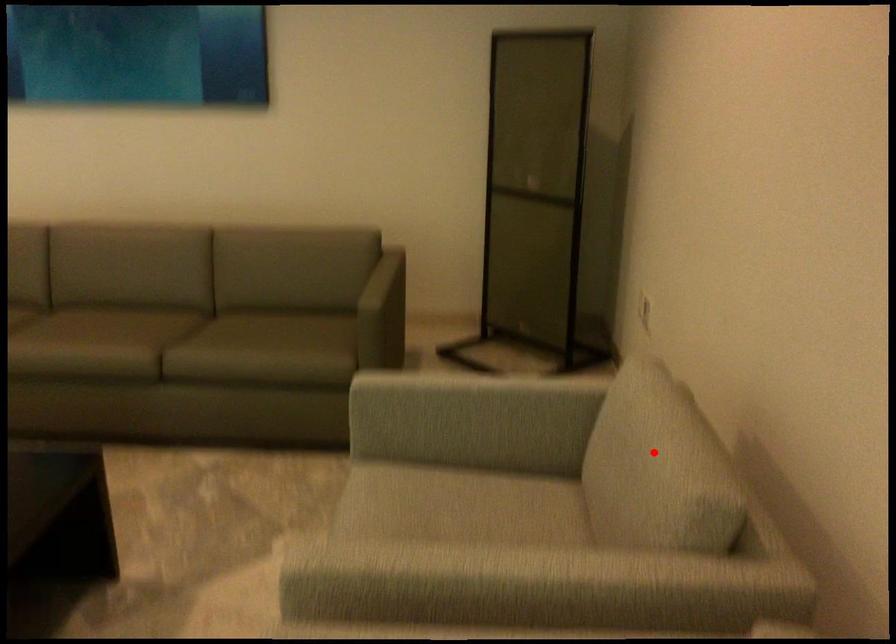
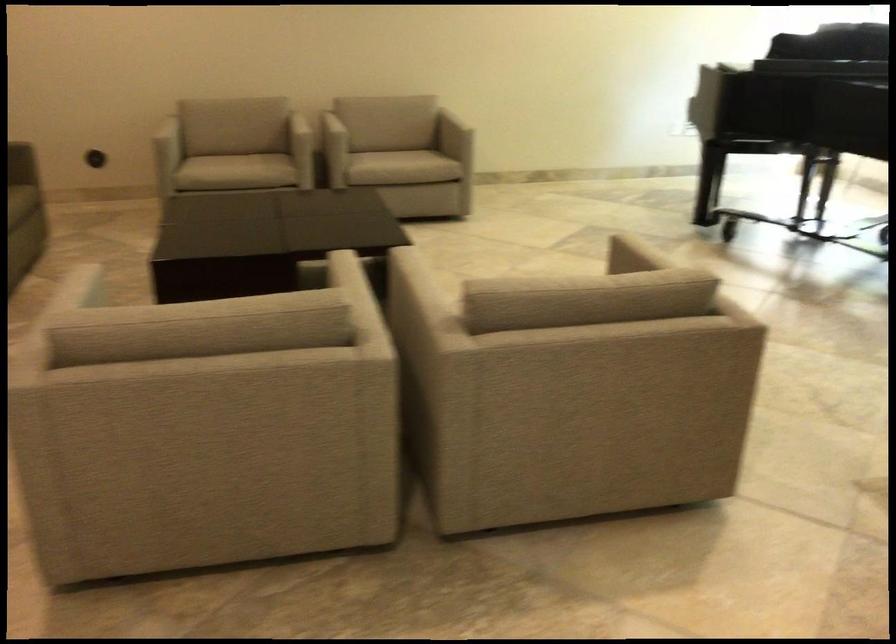
In the second image, find the point that corresponds to the highlighted location in the first image.

(245, 98)